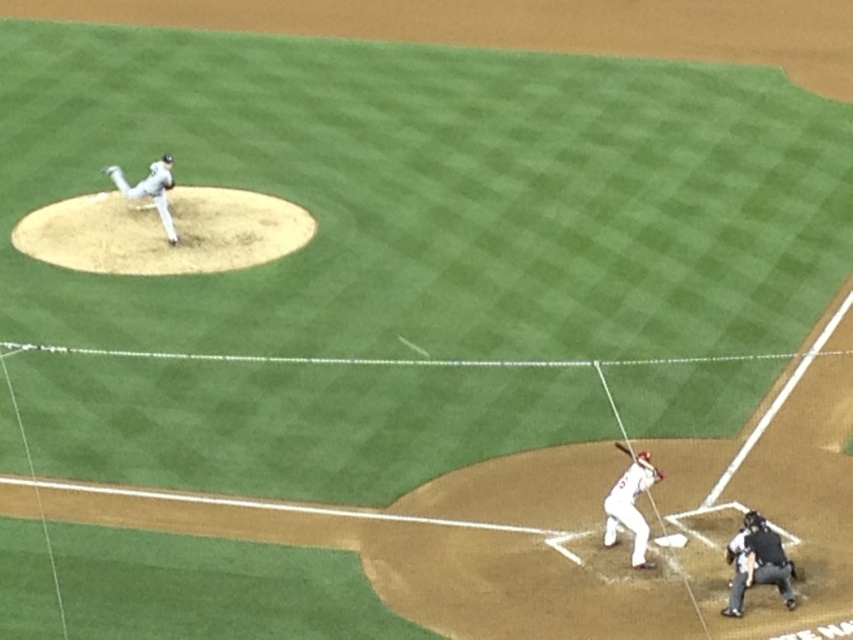
Question: Is brown dirt mound at upper left bigger than white matte baseball pitcher at upper left?

Choices:
 (A) no
 (B) yes

Answer: (B)

Question: Which of the following is the farthest from the observer?

Choices:
 (A) white matte baseball pitcher at upper left
 (B) brown dirt mound at upper left
 (C) brown leather glove at lower right

Answer: (A)

Question: Which is farther from the white matte baseball bat at lower right?

Choices:
 (A) wooden bat at lower center
 (B) black leather umpire at lower right
 (C) brown leather glove at lower right

Answer: (B)

Question: Is white matte baseball bat at lower right to the right of brown leather glove at lower right from the viewer's perspective?

Choices:
 (A) no
 (B) yes

Answer: (A)

Question: Which of the following is the farthest from the observer?

Choices:
 (A) wooden bat at lower center
 (B) brown leather glove at lower right

Answer: (A)

Question: Is white matte baseball bat at lower right smaller than brown leather glove at lower right?

Choices:
 (A) yes
 (B) no

Answer: (B)